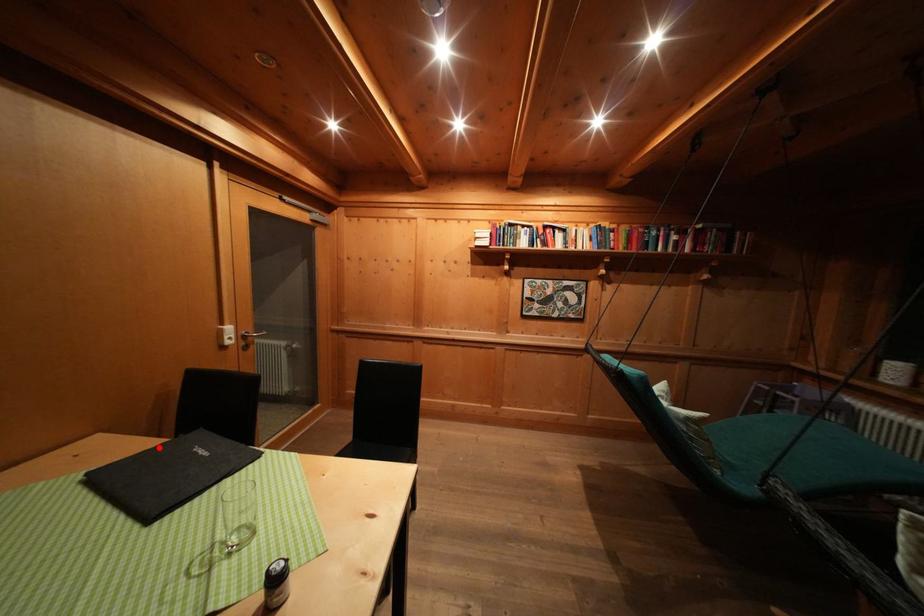
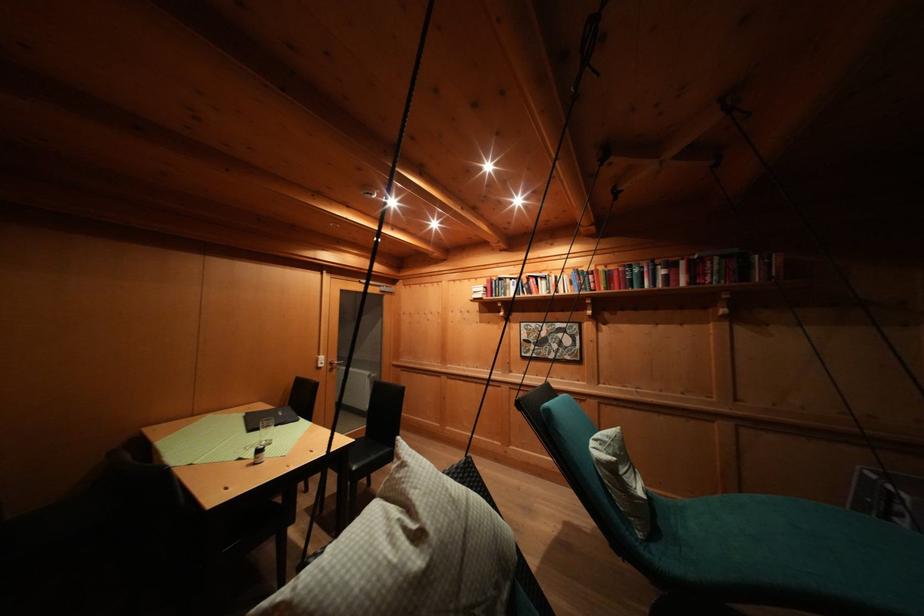
In the second image, find the point that corresponds to the highlighted location in the first image.

(275, 411)